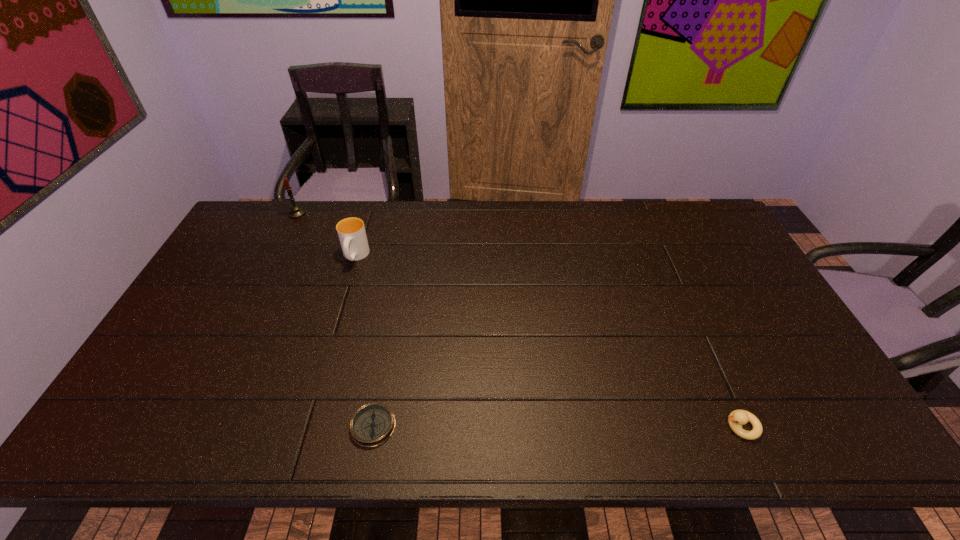
This screenshot has width=960, height=540. I want to click on vacant region located at the beak of the duckling, so click(697, 427).

Find the location of `vacant area situated at the beak of the duckling`. vacant area situated at the beak of the duckling is located at coordinates (558, 427).

Locate an element on the screen. The image size is (960, 540). free spot located 0.120m at the beak of the duckling is located at coordinates (671, 427).

In order to click on vacant region located 0.330m on the back of the second object from right to left in this screenshot , I will do `click(396, 303)`.

Locate an element on the screen. The height and width of the screenshot is (540, 960). object at the far edge is located at coordinates (295, 211).

Find the location of a particular element. This screenshot has height=540, width=960. duckling situated at the near edge is located at coordinates (737, 418).

The image size is (960, 540). I want to click on compass that is positioned at the near edge, so click(372, 424).

This screenshot has width=960, height=540. I want to click on object that is at the left edge, so click(x=295, y=211).

Find the location of a particular element. This screenshot has width=960, height=540. object at the far left corner is located at coordinates (x=295, y=211).

In the image, there is a desktop. Identify the location of vacant space at the far edge. (325, 238).